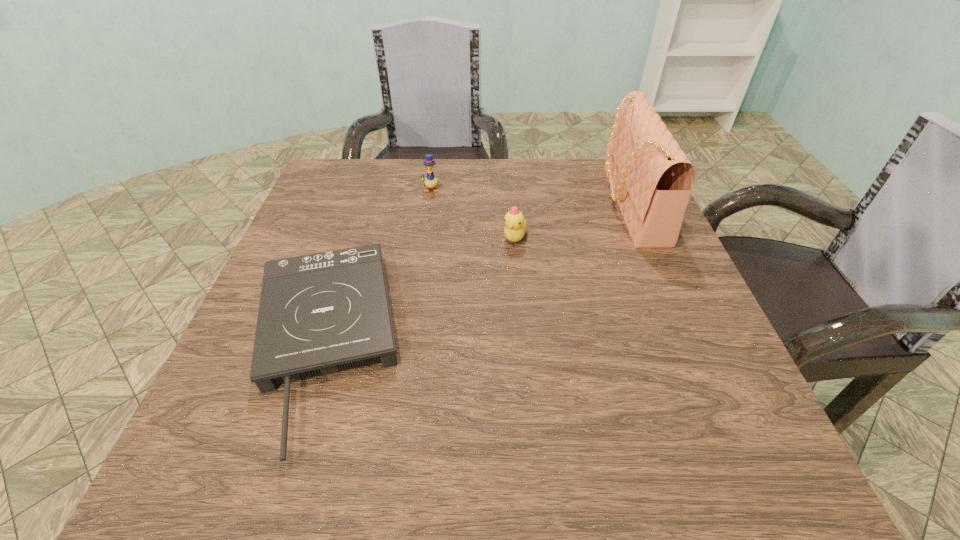
Locate an element on the screen. Image resolution: width=960 pixels, height=540 pixels. vacant space located 0.260m on the face of the left duckling, where the monocle is placed is located at coordinates (420, 262).

What are the coordinates of `vacant region located on the front-facing side of the right duckling` in the screenshot? It's located at (527, 379).

Where is `free spot located 0.130m on the right of the nearest object`? The image size is (960, 540). free spot located 0.130m on the right of the nearest object is located at coordinates (476, 343).

Locate an element on the screen. The width and height of the screenshot is (960, 540). handbag at the far edge is located at coordinates (651, 179).

The height and width of the screenshot is (540, 960). I want to click on duckling at the far edge, so click(430, 181).

Where is `object positioned at the near edge`? object positioned at the near edge is located at coordinates (322, 313).

Find the location of a particular element. object situated at the left edge is located at coordinates [322, 313].

I want to click on object at the right edge, so click(x=651, y=179).

This screenshot has height=540, width=960. In order to click on object that is at the near left corner in this screenshot , I will do `click(322, 313)`.

Identify the location of object that is at the far right corner. Image resolution: width=960 pixels, height=540 pixels. (651, 179).